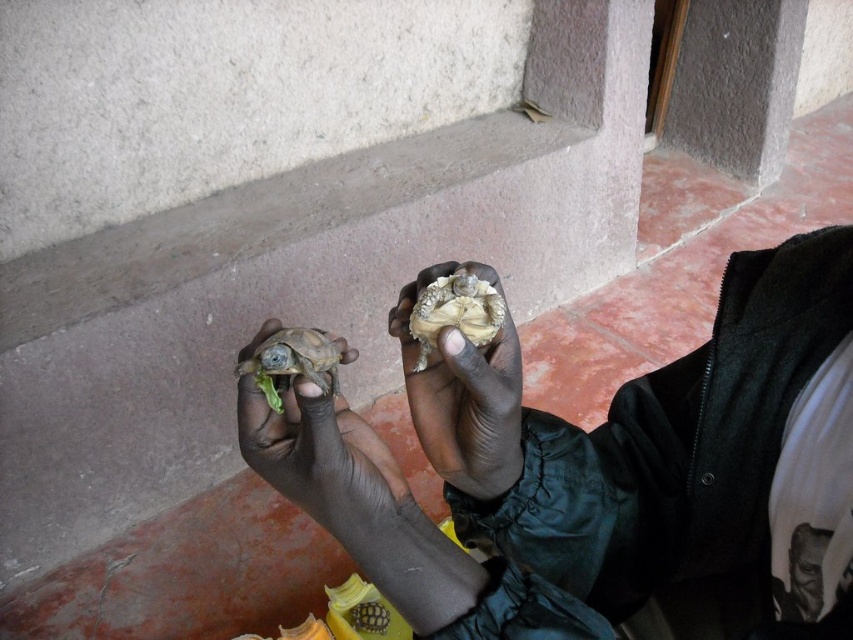
Question: Which object is closer to the camera taking this photo?

Choices:
 (A) smooth green tortoise at center
 (B) smooth brown turtle at center
 (C) brown matte turtle at center
 (D) light brown textured shell at center

Answer: (B)

Question: Which point is closer to the camera?

Choices:
 (A) (x=659, y=547)
 (B) (x=332, y=388)

Answer: (B)

Question: Is smooth brown tortoise at center wider than smooth green tortoise at center?

Choices:
 (A) yes
 (B) no

Answer: (A)

Question: Which point appears farthest from the camera in this image?

Choices:
 (A) (490, 337)
 (B) (674, 512)

Answer: (B)

Question: Is brown matte turtle at center smaller than light brown textured shell at center?

Choices:
 (A) no
 (B) yes

Answer: (A)

Question: Can you confirm if smooth brown tortoise at center is thinner than brown matte turtle at center?

Choices:
 (A) yes
 (B) no

Answer: (A)